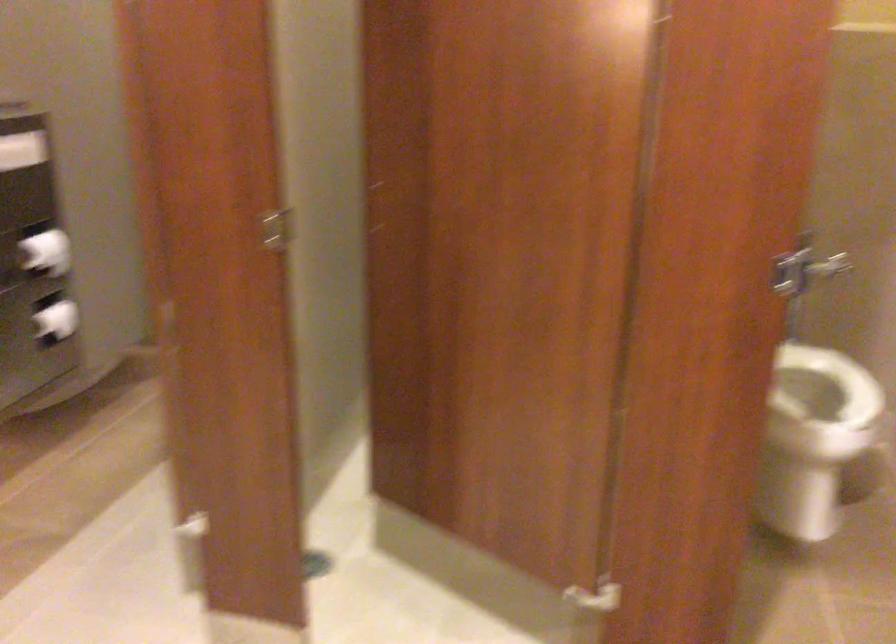
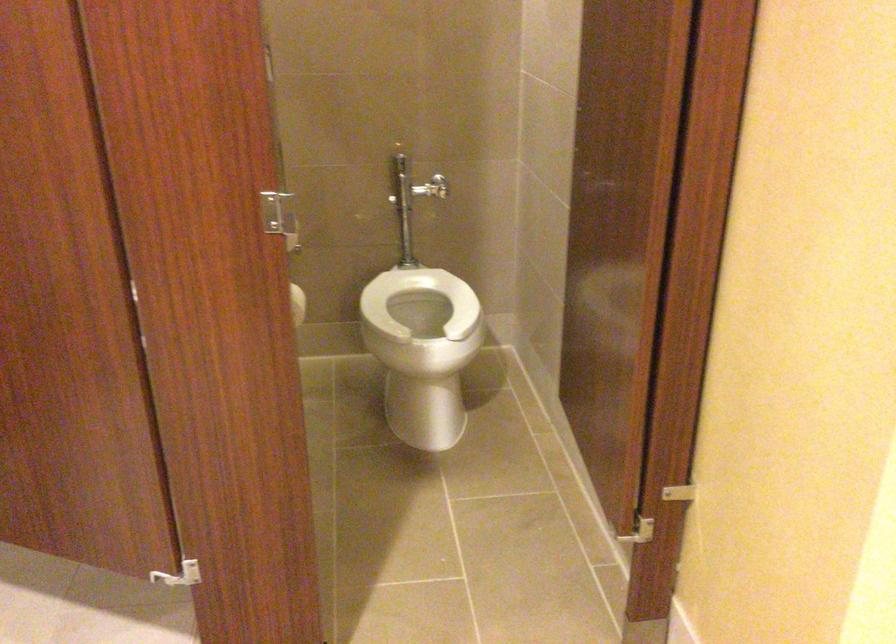
Locate, in the second image, the point that corresponds to point 807,370 in the first image.

(419, 301)